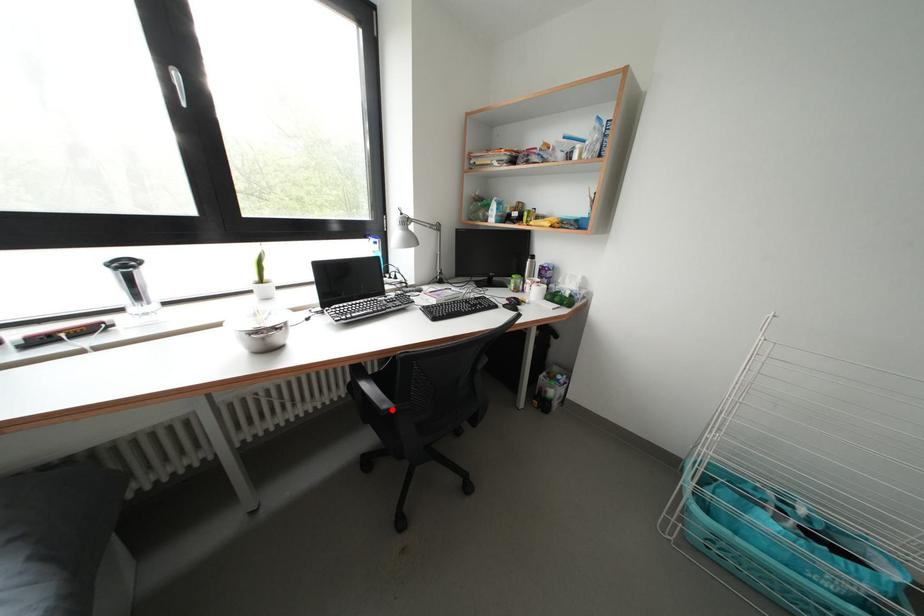
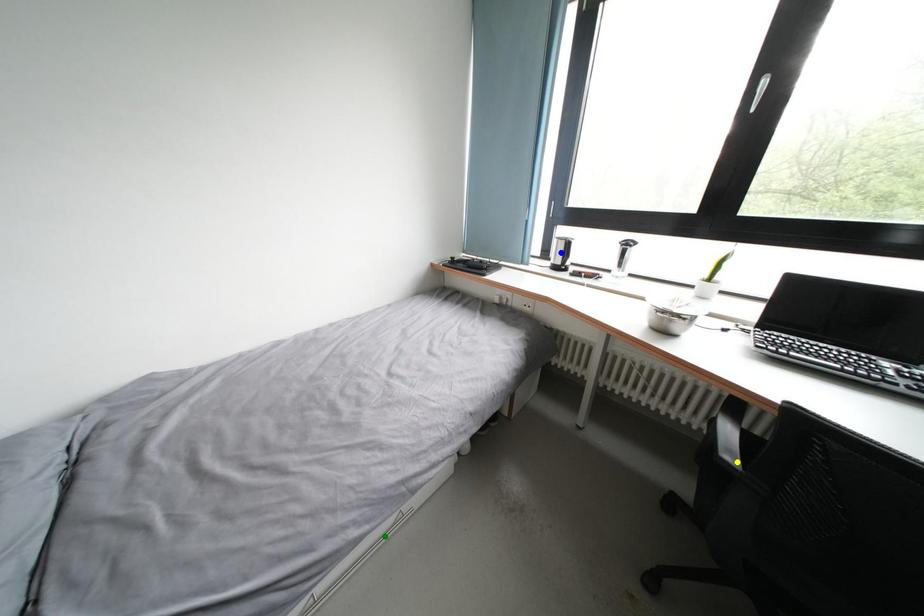
Question: I am providing you with two images of the same scene from different viewpoints. A red point is marked on the first image. You are given multiple points on the second image. Which spot in image 2 lines up with the point in image 1?

Choices:
 (A) yellow point
 (B) blue point
 (C) green point

Answer: (A)